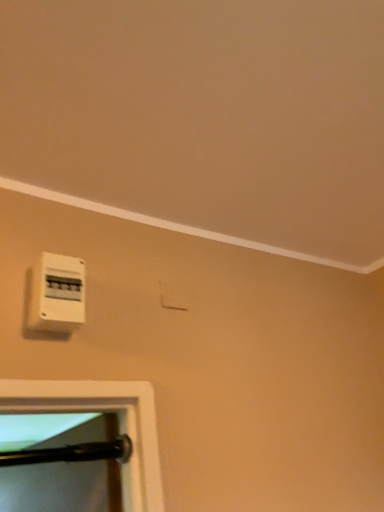
This screenshot has height=512, width=384. Describe the element at coordinates (57, 294) in the screenshot. I see `white plastic electric outlet at upper left` at that location.

Measure the distance between white plastic electric outlet at upper left and camera.

The distance of white plastic electric outlet at upper left from camera is 32.13 inches.

The height and width of the screenshot is (512, 384). I want to click on white plastic electric outlet at upper left, so click(x=57, y=294).

Where is `white plastic electric outlet at upper left`? The image size is (384, 512). white plastic electric outlet at upper left is located at coordinates (57, 294).